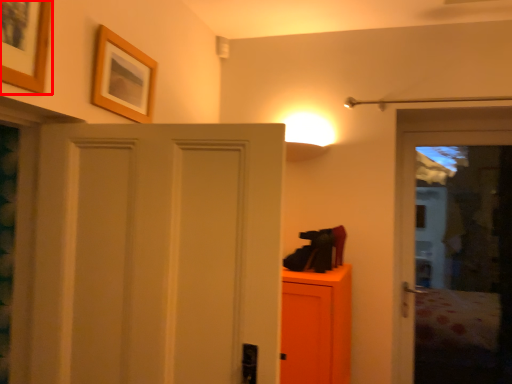
Question: In this image, where is picture frame (annotated by the red box) located relative to picture frame?

Choices:
 (A) right
 (B) left

Answer: (B)